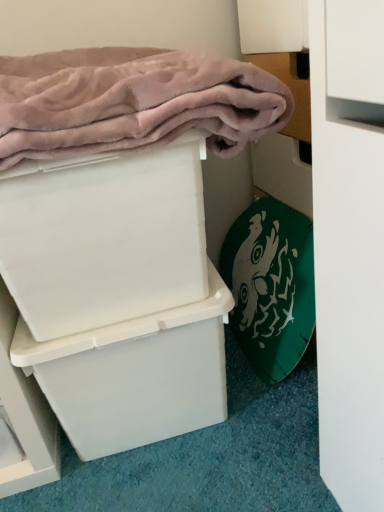
Question: Based on their sizes in the image, would you say white plastic box at upper left, which is counted as the 2th box, starting from the bottom, is bigger or smaller than white plastic box at center, the second box viewed from the top?

Choices:
 (A) big
 (B) small

Answer: (B)

Question: From the image's perspective, is white plastic box at upper left, the first box in the top-to-bottom sequence, above or below white plastic box at center, the second box viewed from the top?

Choices:
 (A) above
 (B) below

Answer: (A)

Question: Which is nearer to the white plastic box at upper left, which is counted as the 2th box, starting from the bottom?

Choices:
 (A) pink plush bath towel at upper left, which ranks as the first bath towel in top-to-bottom order
 (B) green fabric bath towel at lower right, positioned as the second bath towel in top-to-bottom order
 (C) white plastic box at center, the first box in the bottom-to-top sequence

Answer: (A)

Question: Which object is the closest to the white plastic box at upper left, which is counted as the 2th box, starting from the bottom?

Choices:
 (A) white plastic box at center, the first box in the bottom-to-top sequence
 (B) pink plush bath towel at upper left, which ranks as the first bath towel in top-to-bottom order
 (C) green fabric bath towel at lower right, which is the first bath towel from bottom to top

Answer: (B)